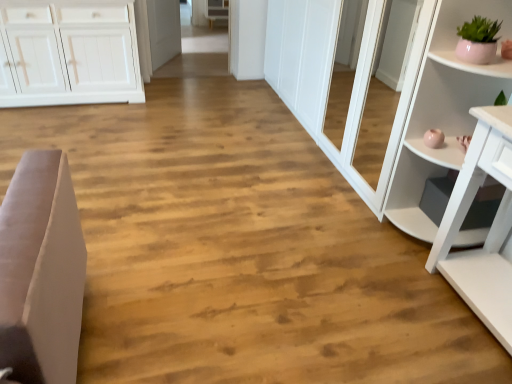
Question: From the image's perspective, is matte pink pot at upper right below white glossy shelf at right?

Choices:
 (A) no
 (B) yes

Answer: (A)

Question: Does matte pink pot at upper right lie behind white glossy shelf at right?

Choices:
 (A) yes
 (B) no

Answer: (A)

Question: Is matte pink pot at upper right turned away from white glossy shelf at right?

Choices:
 (A) no
 (B) yes

Answer: (B)

Question: Can you confirm if matte pink pot at upper right is wider than white glossy shelf at right?

Choices:
 (A) no
 (B) yes

Answer: (A)

Question: Is white glossy shelf at right completely or partially inside matte pink pot at upper right?

Choices:
 (A) no
 (B) yes

Answer: (A)

Question: Is point (222, 16) positioned closer to the camera than point (497, 29)?

Choices:
 (A) farther
 (B) closer

Answer: (A)

Question: In the image, is white wood cabinet at upper center positioned in front of or behind matte pink pot at upper right?

Choices:
 (A) front
 (B) behind

Answer: (B)

Question: Considering the relative positions of white wood cabinet at upper center and matte pink pot at upper right in the image provided, is white wood cabinet at upper center to the left or to the right of matte pink pot at upper right?

Choices:
 (A) right
 (B) left

Answer: (B)

Question: From the image's perspective, is white wood cabinet at upper center located above or below matte pink pot at upper right?

Choices:
 (A) below
 (B) above

Answer: (B)

Question: In terms of width, does white wood cabinet at upper center look wider or thinner when compared to white glossy shelf at right?

Choices:
 (A) thin
 (B) wide

Answer: (A)

Question: From their relative heights in the image, would you say white wood cabinet at upper center is taller or shorter than white glossy shelf at right?

Choices:
 (A) tall
 (B) short

Answer: (B)

Question: Looking at the image, does white wood cabinet at upper center seem bigger or smaller compared to white glossy shelf at right?

Choices:
 (A) big
 (B) small

Answer: (B)

Question: From the image's perspective, is white wood cabinet at upper center located above or below white glossy shelf at right?

Choices:
 (A) below
 (B) above

Answer: (B)

Question: Considering their positions, is matte pink pot at upper right located in front of or behind white glossy door at center?

Choices:
 (A) behind
 (B) front

Answer: (B)

Question: Is point (492, 34) closer or farther from the camera than point (161, 51)?

Choices:
 (A) farther
 (B) closer

Answer: (B)